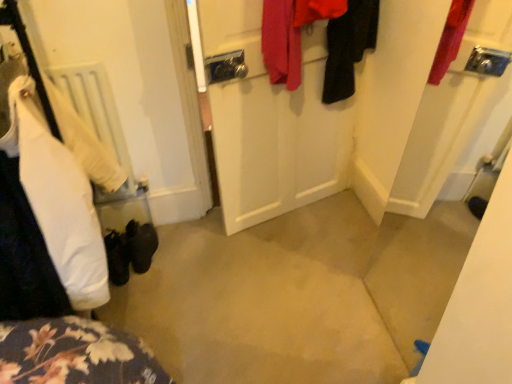
Locate an element on the screen. The height and width of the screenshot is (384, 512). black fabric coat at upper right, which ranks as the 1th clothing in right-to-left order is located at coordinates (348, 47).

The image size is (512, 384). Identify the location of red fabric coat at upper center, which ranks as the second clothing in right-to-left order. (348, 46).

Describe the element at coordinates (271, 122) in the screenshot. I see `white matte door at center` at that location.

Describe the element at coordinates (140, 245) in the screenshot. This screenshot has width=512, height=384. I see `black suede shoes at lower left` at that location.

The height and width of the screenshot is (384, 512). I want to click on black fabric coat at upper right, which ranks as the 1th clothing in right-to-left order, so click(348, 47).

Consider the image. Can you confirm if black suede shoes at lower left is wider than black fabric coat at upper right, the third clothing viewed from the left?

Yes.

Is black suede shoes at lower left outside of black fabric coat at upper right, which ranks as the 1th clothing in right-to-left order?

black suede shoes at lower left is positioned outside black fabric coat at upper right, which ranks as the 1th clothing in right-to-left order.

Where is `footwear located below the black fabric coat at upper right, the third clothing viewed from the left (from the image's perspective)`? The image size is (512, 384). footwear located below the black fabric coat at upper right, the third clothing viewed from the left (from the image's perspective) is located at coordinates coord(140,245).

Considering the sizes of objects black suede shoes at lower left and black fabric coat at upper right, the third clothing viewed from the left, in the image provided, who is taller, black suede shoes at lower left or black fabric coat at upper right, the third clothing viewed from the left,?

black fabric coat at upper right, the third clothing viewed from the left.

How much distance is there between white matte radiator at left and white cotton shirt at left, the 1th clothing viewed from the left?

48.76 centimeters.

Is white matte radiator at left surrounding white cotton shirt at left, arranged as the third clothing when viewed from the right?

No, white matte radiator at left does not contain white cotton shirt at left, arranged as the third clothing when viewed from the right.

Could you tell me if white matte radiator at left is turned towards white cotton shirt at left, arranged as the third clothing when viewed from the right?

Yes, white matte radiator at left faces towards white cotton shirt at left, arranged as the third clothing when viewed from the right.

From a real-world perspective, between white matte radiator at left and white cotton shirt at left, arranged as the third clothing when viewed from the right, who is vertically higher?

From a 3D spatial view, white cotton shirt at left, arranged as the third clothing when viewed from the right, is above.

Considering the positions of objects white matte radiator at left and white matte door at center in the image provided, who is in front, white matte radiator at left or white matte door at center?

white matte door at center is more forward.

Is white matte radiator at left oriented towards white matte door at center?

No, white matte radiator at left does not turn towards white matte door at center.

Which of these two, white matte radiator at left or white matte door at center, is smaller?

Smaller between the two is white matte radiator at left.

Does white matte radiator at left contain white matte door at center?

No.

In the scene shown: From the image's perspective, is red fabric coat at upper center, arranged as the 2th clothing when viewed from the left, located above black fabric coat at upper right, the third clothing viewed from the left?

No.

Considering the relative sizes of red fabric coat at upper center, arranged as the 2th clothing when viewed from the left, and black fabric coat at upper right, which ranks as the 1th clothing in right-to-left order, in the image provided, is red fabric coat at upper center, arranged as the 2th clothing when viewed from the left, bigger than black fabric coat at upper right, which ranks as the 1th clothing in right-to-left order,?

Yes.

Considering the relative sizes of red fabric coat at upper center, which ranks as the second clothing in right-to-left order, and black fabric coat at upper right, which ranks as the 1th clothing in right-to-left order, in the image provided, is red fabric coat at upper center, which ranks as the second clothing in right-to-left order, wider than black fabric coat at upper right, which ranks as the 1th clothing in right-to-left order,?

Yes, red fabric coat at upper center, which ranks as the second clothing in right-to-left order, is wider than black fabric coat at upper right, which ranks as the 1th clothing in right-to-left order.

From the picture: Which object is positioned more to the left, red fabric coat at upper center, arranged as the 2th clothing when viewed from the left, or black fabric coat at upper right, the third clothing viewed from the left?

red fabric coat at upper center, arranged as the 2th clothing when viewed from the left, is more to the left.

From a real-world perspective, is black fabric coat at upper right, the third clothing viewed from the left, over white matte door at center?

Yes, from a real-world perspective, black fabric coat at upper right, the third clothing viewed from the left, is over white matte door at center

Is black fabric coat at upper right, the third clothing viewed from the left, facing towards white matte door at center?

Yes.

Is black fabric coat at upper right, which ranks as the 1th clothing in right-to-left order, not close to white matte door at center?

No.

Is black suede shoes at lower left not inside red fabric coat at upper center, which ranks as the second clothing in right-to-left order?

black suede shoes at lower left is positioned outside red fabric coat at upper center, which ranks as the second clothing in right-to-left order.

Would you consider black suede shoes at lower left to be distant from red fabric coat at upper center, which ranks as the second clothing in right-to-left order?

Absolutely, black suede shoes at lower left is distant from red fabric coat at upper center, which ranks as the second clothing in right-to-left order.

The width and height of the screenshot is (512, 384). Find the location of `footwear that appears on the left of red fabric coat at upper center, arranged as the 2th clothing when viewed from the left`. footwear that appears on the left of red fabric coat at upper center, arranged as the 2th clothing when viewed from the left is located at coordinates (140, 245).

Considering the relative sizes of black suede shoes at lower left and red fabric coat at upper center, which ranks as the second clothing in right-to-left order, in the image provided, is black suede shoes at lower left shorter than red fabric coat at upper center, which ranks as the second clothing in right-to-left order,?

Indeed, black suede shoes at lower left has a lesser height compared to red fabric coat at upper center, which ranks as the second clothing in right-to-left order.

Measure the distance between white matte door at center and white cotton shirt at left, arranged as the third clothing when viewed from the right.

white matte door at center and white cotton shirt at left, arranged as the third clothing when viewed from the right, are 32.73 inches apart.

Does white matte door at center have a greater width compared to white cotton shirt at left, arranged as the third clothing when viewed from the right?

In fact, white matte door at center might be narrower than white cotton shirt at left, arranged as the third clothing when viewed from the right.

Is white matte door at center completely or partially outside of white cotton shirt at left, arranged as the third clothing when viewed from the right?

That's correct, white matte door at center is outside of white cotton shirt at left, arranged as the third clothing when viewed from the right.

Is white matte door at center turned away from white cotton shirt at left, the 1th clothing viewed from the left?

No, white matte door at center is not facing the opposite direction of white cotton shirt at left, the 1th clothing viewed from the left.

Starting from the black suede shoes at lower left, which clothing is the 1st one in front? Please provide its 2D coordinates.

[(348, 47)]

This screenshot has height=384, width=512. I want to click on clothing on the left of the white matte radiator at left, so click(58, 201).

Looking at the image, which one is located further to black suede shoes at lower left, white matte door at center or black fabric coat at upper right, which ranks as the 1th clothing in right-to-left order?

Based on the image, black fabric coat at upper right, which ranks as the 1th clothing in right-to-left order, appears to be further to black suede shoes at lower left.

From the image, which object appears to be nearer to white cotton shirt at left, the 1th clothing viewed from the left, white matte radiator at left or red fabric coat at upper center, which ranks as the second clothing in right-to-left order?

white matte radiator at left.

When comparing their distances from black fabric coat at upper right, the third clothing viewed from the left, does white cotton shirt at left, the 1th clothing viewed from the left, or red fabric coat at upper center, which ranks as the second clothing in right-to-left order, seem closer?

The object closer to black fabric coat at upper right, the third clothing viewed from the left, is red fabric coat at upper center, which ranks as the second clothing in right-to-left order.

From the image, which object appears to be nearer to white matte radiator at left, black fabric coat at upper right, the third clothing viewed from the left, or black suede shoes at lower left?

black suede shoes at lower left is positioned closer to the anchor white matte radiator at left.

Looking at the image, which one is located further to white cotton shirt at left, the 1th clothing viewed from the left, black fabric coat at upper right, which ranks as the 1th clothing in right-to-left order, or white matte door at center?

black fabric coat at upper right, which ranks as the 1th clothing in right-to-left order.

From the image, which object appears to be nearer to white cotton shirt at left, the 1th clothing viewed from the left, white matte door at center or black suede shoes at lower left?

Among the two, black suede shoes at lower left is located nearer to white cotton shirt at left, the 1th clothing viewed from the left.

Which object lies further to the anchor point white matte door at center, black fabric coat at upper right, which ranks as the 1th clothing in right-to-left order, or white matte radiator at left?

white matte radiator at left.

Based on their spatial positions, is white cotton shirt at left, arranged as the third clothing when viewed from the right, or white matte door at center further from white matte radiator at left?

white matte door at center is further to white matte radiator at left.

Locate an element on the screen. This screenshot has width=512, height=384. radiator between white cotton shirt at left, arranged as the third clothing when viewed from the right, and red fabric coat at upper center, which ranks as the second clothing in right-to-left order, in the horizontal direction is located at coordinates (90, 120).

The width and height of the screenshot is (512, 384). What are the coordinates of `clothing located between white matte radiator at left and black fabric coat at upper right, the third clothing viewed from the left, in the left-right direction` in the screenshot? It's located at (348, 46).

I want to click on door between white cotton shirt at left, arranged as the third clothing when viewed from the right, and black suede shoes at lower left from front to back, so click(x=271, y=122).

Find the location of `footwear located between white matte radiator at left and red fabric coat at upper center, which ranks as the second clothing in right-to-left order, in the left-right direction`. footwear located between white matte radiator at left and red fabric coat at upper center, which ranks as the second clothing in right-to-left order, in the left-right direction is located at coordinates (140, 245).